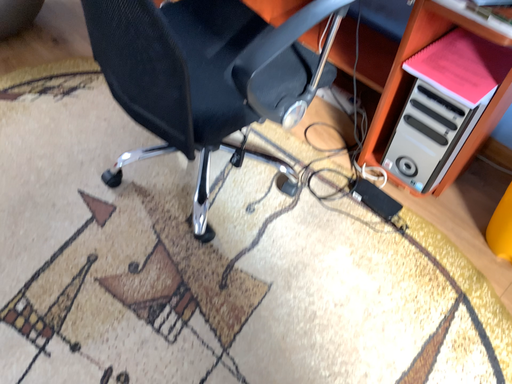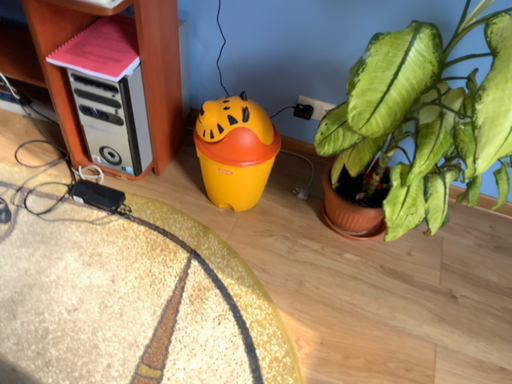
Question: Which way did the camera rotate in the video?

Choices:
 (A) rotated downward
 (B) rotated upward

Answer: (B)